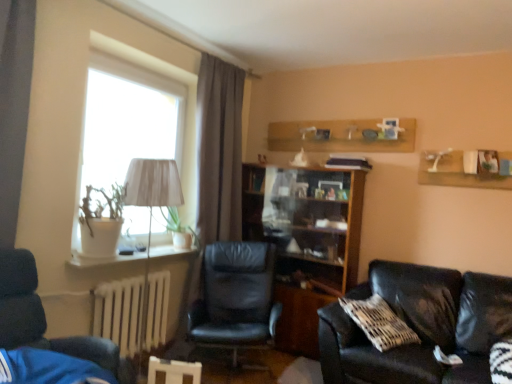
You are a GUI agent. You are given a task and a screenshot of the screen. Output one action in this format:
    pyautogui.click(x=<x>, y=<y>)
    Task: Click on the black leather couch at lower right
    
    Given the screenshot: What is the action you would take?
    pyautogui.click(x=419, y=326)

Find the location of a particular element. black leather chair at center, which is the 1th chair in back-to-front order is located at coordinates click(236, 298).

Identify the location of dark blue leather chair at left, the 2th chair viewed from the back. (40, 315).

Considering their positions, is white fabric lampshade at left located in front of or behind black leather chair at center, which is counted as the first chair, starting from the right?

white fabric lampshade at left is in front of black leather chair at center, which is counted as the first chair, starting from the right.

Would you say white fabric lampshade at left is outside black leather chair at center, which is the 1th chair in back-to-front order?

That's correct, white fabric lampshade at left is outside of black leather chair at center, which is the 1th chair in back-to-front order.

Does white fabric lampshade at left appear on the left side of black leather chair at center, which ranks as the second chair in front-to-back order?

Indeed, white fabric lampshade at left is positioned on the left side of black leather chair at center, which ranks as the second chair in front-to-back order.

Which is in front, point (407, 290) or point (165, 283)?

Positioned in front is point (407, 290).

Between black leather couch at lower right and white painted metal radiator at lower left, which one has larger width?

With larger width is black leather couch at lower right.

Does black leather couch at lower right have a larger size compared to white painted metal radiator at lower left?

Yes.

From a real-world perspective, which object stands above the other?

black leather couch at lower right.

Does white painted metal radiator at lower left have a greater height compared to white fabric lampshade at left?

In fact, white painted metal radiator at lower left may be shorter than white fabric lampshade at left.

In terms of width, does white painted metal radiator at lower left look wider or thinner when compared to white fabric lampshade at left?

Clearly, white painted metal radiator at lower left has less width compared to white fabric lampshade at left.

Is point (133, 338) farther from viewer compared to point (177, 172)?

No, it is in front of (177, 172).

From the picture: Can you confirm if white painted metal radiator at lower left is smaller than white fabric lampshade at left?

Correct, white painted metal radiator at lower left occupies less space than white fabric lampshade at left.

Is wooden bookshelf at center wider or thinner than dark blue leather chair at left, the 2th chair viewed from the back?

Considering their sizes, wooden bookshelf at center looks slimmer than dark blue leather chair at left, the 2th chair viewed from the back.

Considering the relative sizes of wooden bookshelf at center and dark blue leather chair at left, the 2th chair viewed from the back, in the image provided, is wooden bookshelf at center taller than dark blue leather chair at left, the 2th chair viewed from the back,?

Yes, wooden bookshelf at center is taller than dark blue leather chair at left, the 2th chair viewed from the back.

Is wooden bookshelf at center facing towards dark blue leather chair at left, which is counted as the 1th chair, starting from the front?

Yes, wooden bookshelf at center faces towards dark blue leather chair at left, which is counted as the 1th chair, starting from the front.

Is the position of wooden bookshelf at center more distant than that of dark blue leather chair at left, the 2th chair viewed from the back?

Yes, wooden bookshelf at center is behind dark blue leather chair at left, the 2th chair viewed from the back.

Are white painted metal radiator at lower left and wooden bookshelf at center far apart?

Yes, white painted metal radiator at lower left and wooden bookshelf at center are quite far apart.

In order to click on radiator that is below the wooden bookshelf at center (from the image's perspective) in this screenshot , I will do `click(120, 313)`.

Is white painted metal radiator at lower left located outside wooden bookshelf at center?

white painted metal radiator at lower left lies outside wooden bookshelf at center's area.

Can you confirm if white painted metal radiator at lower left is smaller than wooden bookshelf at center?

Correct, white painted metal radiator at lower left occupies less space than wooden bookshelf at center.

Looking at this image, is white fabric lampshade at left closer to camera compared to black leather couch at lower right?

No, white fabric lampshade at left is further to the viewer.

Are white fabric lampshade at left and black leather couch at lower right located far from each other?

Yes, white fabric lampshade at left is far from black leather couch at lower right.

From the picture: Who is taller, white fabric lampshade at left or black leather couch at lower right?

Standing taller between the two is white fabric lampshade at left.

How many degrees apart are the facing directions of white fabric lampshade at left and black leather couch at lower right?

The angular difference between white fabric lampshade at left and black leather couch at lower right is 87.2 degrees.

From the image's perspective, which one is positioned higher, black leather chair at center, which ranks as the second chair in front-to-back order, or black leather couch at lower right?

black leather chair at center, which ranks as the second chair in front-to-back order, appears higher in the image.

Find the location of a particular element. This screenshot has height=384, width=512. chair that is the 1st object to the left of the black leather couch at lower right, starting at the anchor is located at coordinates (236, 298).

Which of these two, black leather chair at center, the 2th chair in the left-to-right sequence, or black leather couch at lower right, stands shorter?

black leather couch at lower right is shorter.

In order to click on chair that is the 2nd object located below the white fabric lampshade at left (from the image's perspective) in this screenshot , I will do `click(236, 298)`.

I want to click on studio couch that is in front of the white painted metal radiator at lower left, so click(419, 326).

From the image, which object appears to be farther from black leather couch at lower right, black leather chair at center, which is the 1th chair in back-to-front order, or white fabric lampshade at left?

Based on the image, white fabric lampshade at left appears to be further to black leather couch at lower right.

When comparing their distances from wooden bookshelf at center, does white painted metal radiator at lower left or black leather couch at lower right seem further?

white painted metal radiator at lower left lies further to wooden bookshelf at center than the other object.

Estimate the real-world distances between objects in this image. Which object is closer to dark blue leather chair at left, the 2th chair positioned from the right, black leather chair at center, the 2th chair in the left-to-right sequence, or black leather couch at lower right?

Among the two, black leather chair at center, the 2th chair in the left-to-right sequence, is located nearer to dark blue leather chair at left, the 2th chair positioned from the right.

From the image, which object appears to be nearer to white fabric lampshade at left, black leather couch at lower right or wooden bookshelf at center?

The object closer to white fabric lampshade at left is wooden bookshelf at center.

From the image, which object appears to be farther from black leather chair at center, which is counted as the first chair, starting from the right, white painted metal radiator at lower left or white fabric lampshade at left?

Based on the image, white fabric lampshade at left appears to be further to black leather chair at center, which is counted as the first chair, starting from the right.

Considering their positions, is black leather chair at center, which ranks as the second chair in front-to-back order, positioned further to white painted metal radiator at lower left than white fabric lampshade at left?

Among the two, white fabric lampshade at left is located further to white painted metal radiator at lower left.

Looking at the image, which one is located further to black leather couch at lower right, black leather chair at center, which is counted as the first chair, starting from the right, or white painted metal radiator at lower left?

white painted metal radiator at lower left is positioned further to the anchor black leather couch at lower right.

Consider the image. Looking at the image, which one is located closer to black leather couch at lower right, white painted metal radiator at lower left or wooden bookshelf at center?

The object closer to black leather couch at lower right is wooden bookshelf at center.

You are a GUI agent. You are given a task and a screenshot of the screen. Output one action in this format:
    pyautogui.click(x=<x>, y=<y>)
    Task: Click on the radiator between dark blue leather chair at left, the 2th chair viewed from the back, and wooden bookshelf at center in the front-back direction
    This screenshot has height=384, width=512.
    Given the screenshot: What is the action you would take?
    pyautogui.click(x=120, y=313)

Identify the location of chair between white fabric lampshade at left and black leather couch at lower right from left to right. This screenshot has width=512, height=384. (236, 298).

Where is `chair located between dark blue leather chair at left, which is counted as the 1th chair, starting from the front, and wooden bookshelf at center in the depth direction`? chair located between dark blue leather chair at left, which is counted as the 1th chair, starting from the front, and wooden bookshelf at center in the depth direction is located at coordinates (236, 298).

Find the location of a particular element. radiator positioned between dark blue leather chair at left, which is counted as the 1th chair, starting from the front, and white fabric lampshade at left from near to far is located at coordinates (120, 313).